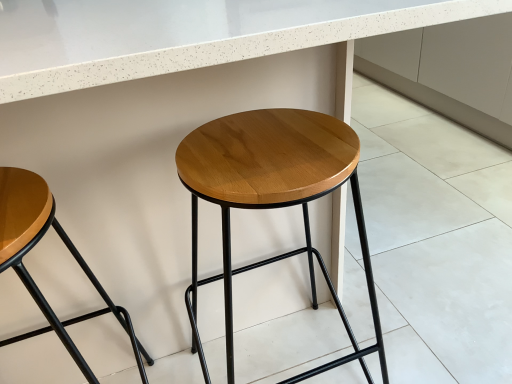
Image resolution: width=512 pixels, height=384 pixels. Find the location of `free spot above wooden/matte stool at center, placed as the 1th stool when sorted from right to left (from a real-world perspective)`. free spot above wooden/matte stool at center, placed as the 1th stool when sorted from right to left (from a real-world perspective) is located at coordinates (267, 147).